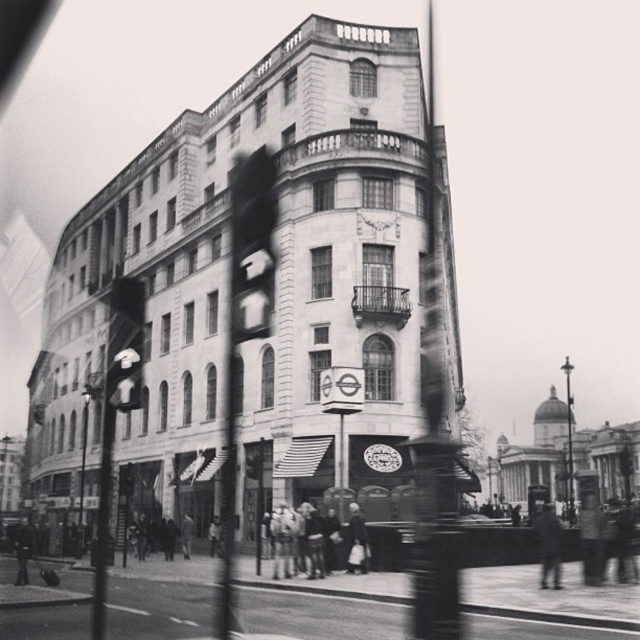
From the picture: You are a delivery person trying to navigate through the sidewalk while avoiding obstacles. You see a dark gray coat at center and a metallic streetlight at right. Which object is wider, requiring more space to maneuver around?

The metallic streetlight at right is wider than the dark gray coat at center, so you should give more space to the metallic streetlight at right when maneuvering around it.

You are a delivery person needing to deliver a package to a recipient standing near the dark gray coat at lower left. You are currently positioned near the dark gray coat at center. The delivery must be made within 2 minutes. Assuming you walk at a constant speed of 1.5 meters per second, will you be able to reach the recipient on time?

The distance between the dark gray coat at center and the dark gray coat at lower left is 49.42 meters. Walking at 1.5 meters per second, it would take approximately 32.95 seconds to cover this distance. Since 32.95 seconds is less than 2 minutes, you will arrive on time.